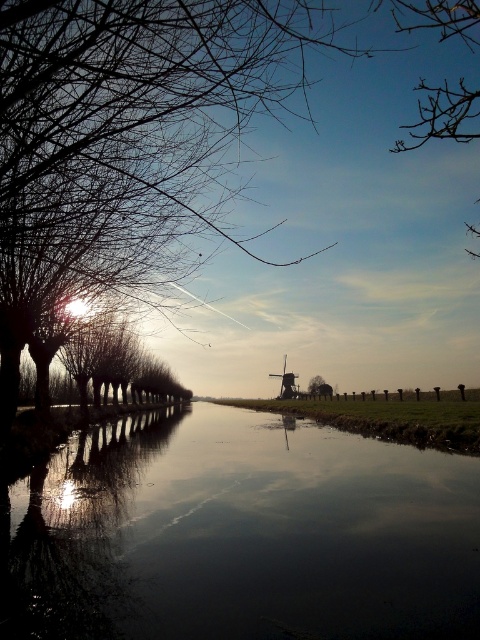
Question: Does dark reflective water at center appear on the left side of bare branches at left?

Choices:
 (A) yes
 (B) no

Answer: (A)

Question: Among these points, which one is nearest to the camera?

Choices:
 (A) (285, 387)
 (B) (14, 112)

Answer: (B)

Question: Which point is farther from the camera taking this photo?

Choices:
 (A) (468, 252)
 (B) (250, 61)

Answer: (A)

Question: Can you confirm if bare branches at upper right is positioned to the left of wooden windmill at center?

Choices:
 (A) no
 (B) yes

Answer: (A)

Question: Can you confirm if dark reflective water at center is thinner than bare branches at upper right?

Choices:
 (A) no
 (B) yes

Answer: (B)

Question: Which point is farther from the camera taking this photo?

Choices:
 (A) 405,129
 (B) 446,614
 (C) 192,76

Answer: (A)